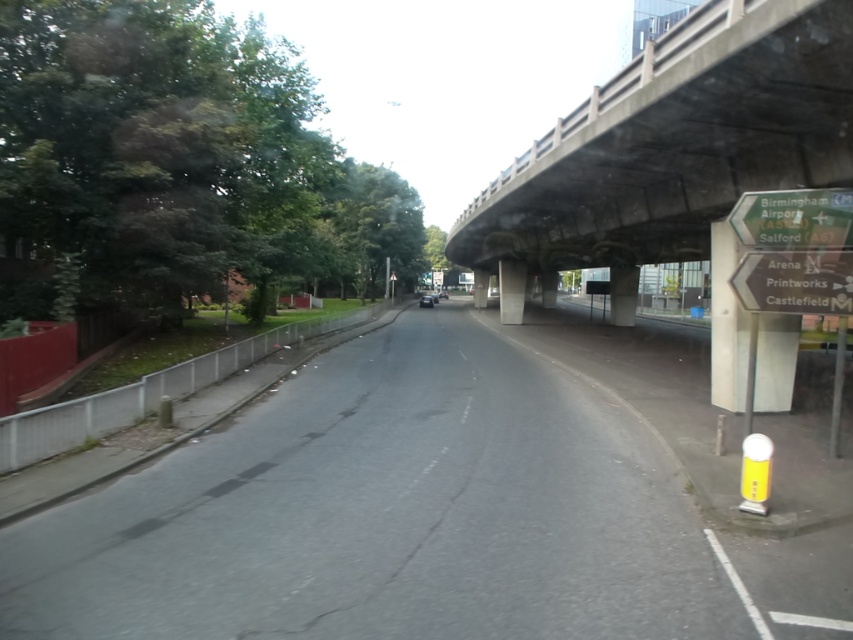
Between point (244, 589) and point (828, 189), which one is positioned behind?

Point (828, 189)

This screenshot has width=853, height=640. I want to click on asphalt road at center, so [413, 516].

In order to click on asphalt road at center in this screenshot , I will do click(413, 516).

Does asphalt road at center have a lesser height compared to concrete at upper center?

Indeed, asphalt road at center has a lesser height compared to concrete at upper center.

At what (x,y) coordinates should I click in order to perform the action: click on asphalt road at center. Please return your answer as a coordinate pair (x, y). Image resolution: width=853 pixels, height=640 pixels. Looking at the image, I should click on (413, 516).

Identify the location of asphalt road at center. This screenshot has width=853, height=640. (413, 516).

Is concrete at upper center bigger than green plastic sign at upper right?

Indeed, concrete at upper center has a larger size compared to green plastic sign at upper right.

Is point (688, 100) more distant than point (752, 241)?

Yes, point (688, 100) is behind point (752, 241).

Identify the location of concrete at upper center. (676, 141).